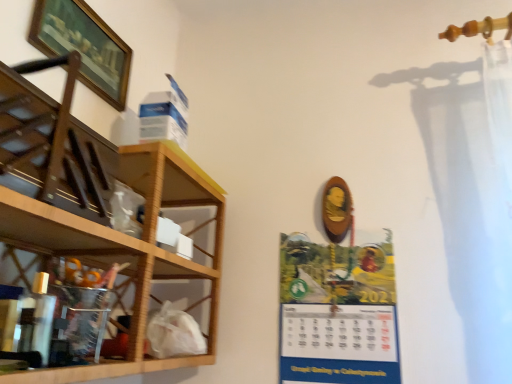
Question: Is translucent plastic cabinet at left thinner than matte paper calendar at center-right?

Choices:
 (A) yes
 (B) no

Answer: (B)

Question: Is translucent plastic cabinet at left taller than matte paper calendar at center-right?

Choices:
 (A) yes
 (B) no

Answer: (B)

Question: Are translucent plastic cabinet at left and matte paper calendar at center-right beside each other?

Choices:
 (A) yes
 (B) no

Answer: (B)

Question: Is the depth of translucent plastic cabinet at left less than that of matte paper calendar at center-right?

Choices:
 (A) no
 (B) yes

Answer: (B)

Question: From a real-world perspective, is translucent plastic cabinet at left under matte paper calendar at center-right?

Choices:
 (A) yes
 (B) no

Answer: (A)

Question: Is translucent plastic cabinet at left behind matte paper calendar at center-right?

Choices:
 (A) yes
 (B) no

Answer: (B)

Question: Is wooden framed picture at upper left beside translucent plastic cabinet at left?

Choices:
 (A) yes
 (B) no

Answer: (B)

Question: Is wooden framed picture at upper left positioned beyond the bounds of translucent plastic cabinet at left?

Choices:
 (A) yes
 (B) no

Answer: (A)

Question: Is translucent plastic cabinet at left located within wooden framed picture at upper left?

Choices:
 (A) yes
 (B) no

Answer: (B)

Question: Is wooden framed picture at upper left bigger than translucent plastic cabinet at left?

Choices:
 (A) no
 (B) yes

Answer: (A)

Question: From the image's perspective, does wooden framed picture at upper left appear lower than translucent plastic cabinet at left?

Choices:
 (A) yes
 (B) no

Answer: (B)

Question: From the image's perspective, is wooden framed picture at upper left over translucent plastic cabinet at left?

Choices:
 (A) no
 (B) yes

Answer: (B)

Question: From a real-world perspective, is wooden at left positioned under wooden framed picture at upper left based on gravity?

Choices:
 (A) yes
 (B) no

Answer: (A)